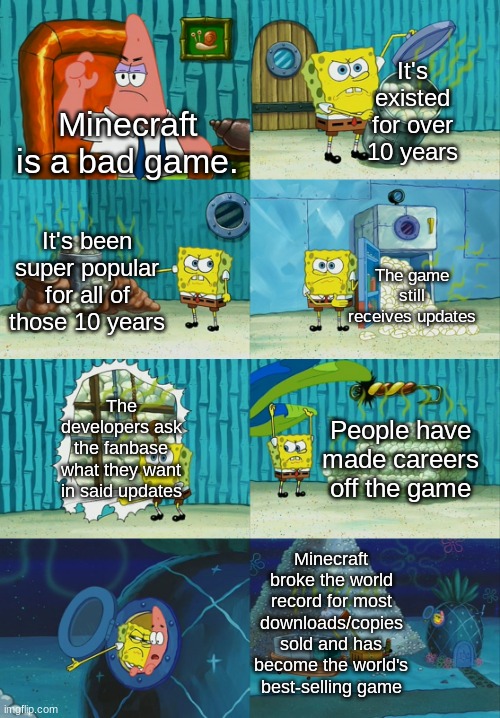
You are a GUI agent. You are given a task and a screenshot of the screen. Output one action in this format:
    pyautogui.click(x=<x>, y=<y>)
    Task: Click on the fridge
    The height and width of the screenshot is (718, 500).
    Given the screenshot: What is the action you would take?
    pyautogui.click(x=425, y=237)